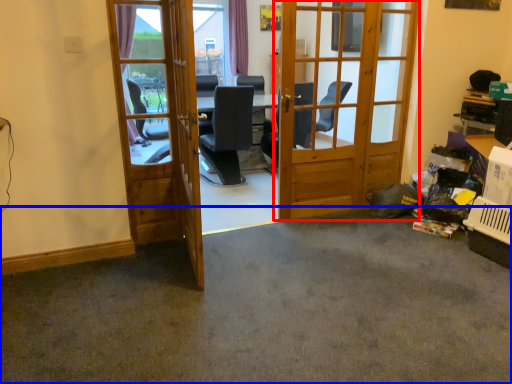
Question: Among these objects, which one is farthest to the camera, door (highlighted by a red box) or concrete (highlighted by a blue box)?

Choices:
 (A) door
 (B) concrete

Answer: (A)